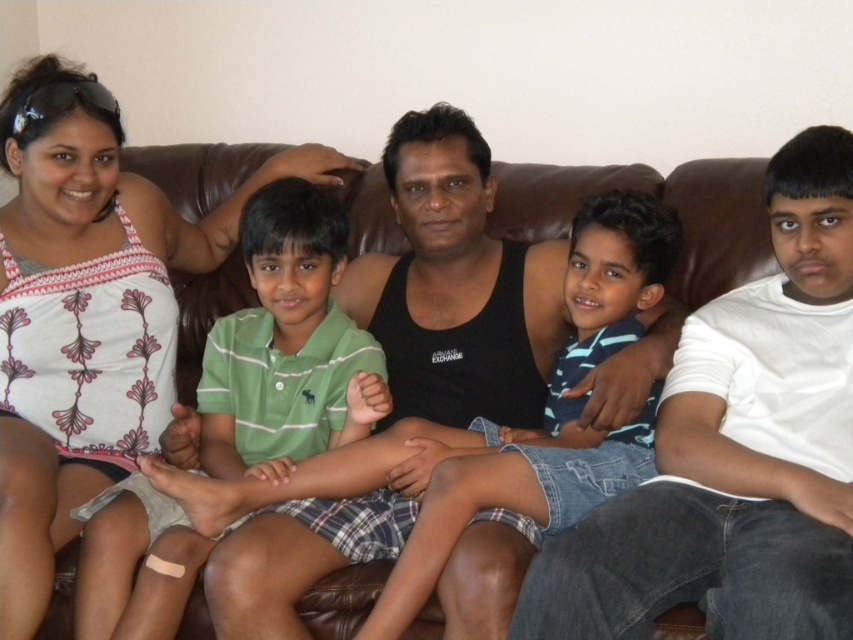
You are a photographer adjusting the camera focus. The blue denim shorts at center and the striped cotton shirt at center are both in the frame. Which item is closer to the camera?

The blue denim shorts at center is 8.10 inches from the striped cotton shirt at center, so the distance between them indicates their proximity. However, without additional information about their positions relative to the camera, it is impossible to determine which is closer.

You are standing in front of the couch and want to place a small plant between the two points on the couch indicated by point 1 at (833,376) and point 2 at (120,236). Which point should the plant be placed closer to ensure it is nearer to the viewer?

The plant should be placed closer to point 1 at (833,376) because it is closer to the viewer than point 2 at (120,236) according to the description.

You are standing in front of the image and notice the white printed tank top at upper left and the black sleeveless tank top at center. Based on their positions, which one is closer to the left edge of the image?

The white printed tank top at upper left is closer to the left edge of the image because it is located at point [86,310], which is further to the left compared to the black sleeveless tank top at center.